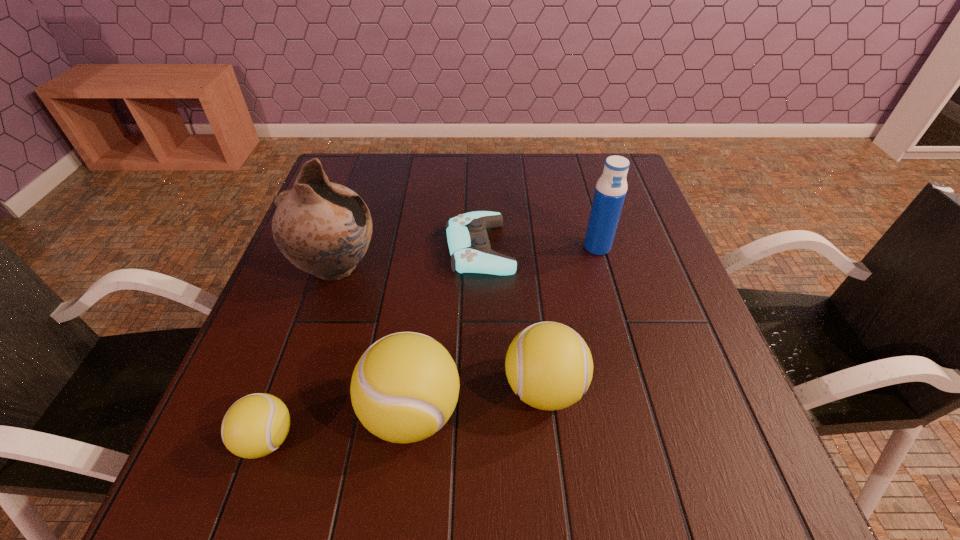
Locate an element on the screen. blank space at the left edge of the desktop is located at coordinates (331, 311).

In the image, there is a desktop. Identify the location of free space at the right edge. (671, 272).

You are a GUI agent. You are given a task and a screenshot of the screen. Output one action in this format:
    pyautogui.click(x=<x>, y=<y>)
    Task: Click on the vacant area at the far left corner of the desktop
    
    Given the screenshot: What is the action you would take?
    pyautogui.click(x=375, y=158)

You are a GUI agent. You are given a task and a screenshot of the screen. Output one action in this format:
    pyautogui.click(x=<x>, y=<y>)
    Task: Click on the vacant space at the far right corner
    The height and width of the screenshot is (540, 960).
    Given the screenshot: What is the action you would take?
    pyautogui.click(x=589, y=153)

The image size is (960, 540). What are the coordinates of `free space between the second shortest object and the second tennis ball from left to right` in the screenshot? It's located at (339, 426).

I want to click on vacant area that lies between the leftmost tennis ball and the pottery, so click(x=301, y=354).

I want to click on unoccupied area between the water bottle and the second tennis ball from right to left, so click(504, 330).

Find the location of a particular element. Image resolution: width=960 pixels, height=540 pixels. vacant space in between the rightmost object and the second tennis ball from left to right is located at coordinates (504, 330).

At what (x,y) coordinates should I click in order to perform the action: click on free space between the control and the water bottle. Please return your answer as a coordinate pair (x, y). Looking at the image, I should click on (539, 248).

Locate an element on the screen. free space that is in between the rightmost object and the second tennis ball from right to left is located at coordinates (504, 330).